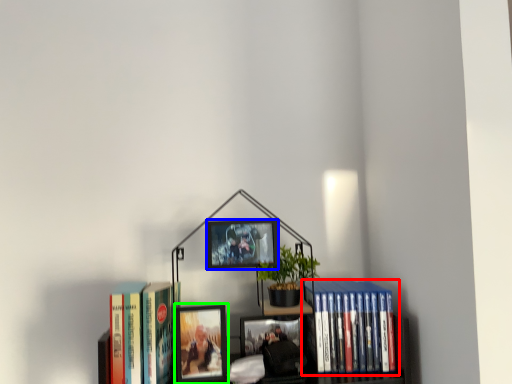
Question: Which object is positioned farthest from book (highlighted by a red box)? Select from picture frame (highlighted by a blue box) and picture frame (highlighted by a green box).

Choices:
 (A) picture frame
 (B) picture frame

Answer: (B)